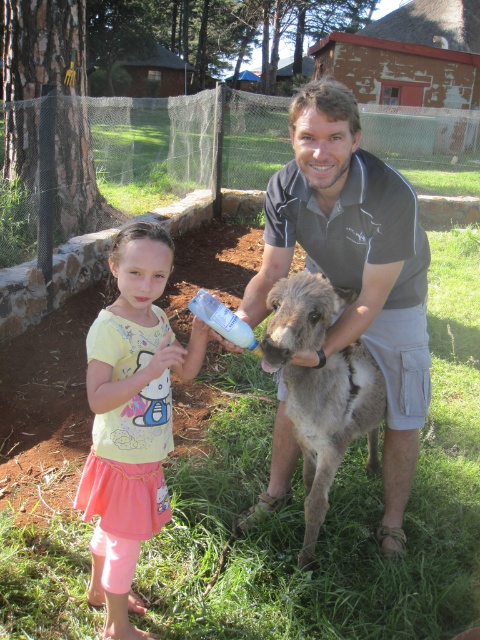
In the scene shown: You are standing at the point marked as point (317, 314) in the image. The distance from you to the viewer is 1.83 meters. If you want to move forward 2 meters, will you be able to see the stone wall behind the grassy area better?

Since you are currently 1.83 meters away from the viewer, moving forward 2 meters would place you 0.17 meters beyond the original position. However, without knowing the terrain or obstacles between you and the stone wall, it is uncertain if moving forward would improve visibility. The answer cannot be determined with the given information.

You are a photographer trying to capture a clear photo of the dark gray shirt at center and the white plastic bottle at center. If you want to ensure both are fully visible in your shot, which object should you frame first to avoid cropping?

The dark gray shirt at center might be wider than the white plastic bottle at center, so you should frame the dark gray shirt at center first to ensure it fits within the frame before adjusting for the white plastic bottle at center.

You are a photographer trying to capture a photo of the dark gray shirt at center and the white plastic bottle at center. If you want to ensure both are fully visible in your shot, which object should you focus on first to avoid cropping either?

The dark gray shirt at center is taller than the white plastic bottle at center, so you should focus on the dark gray shirt at center first to ensure it fits within the frame before adjusting for the shorter bottle.